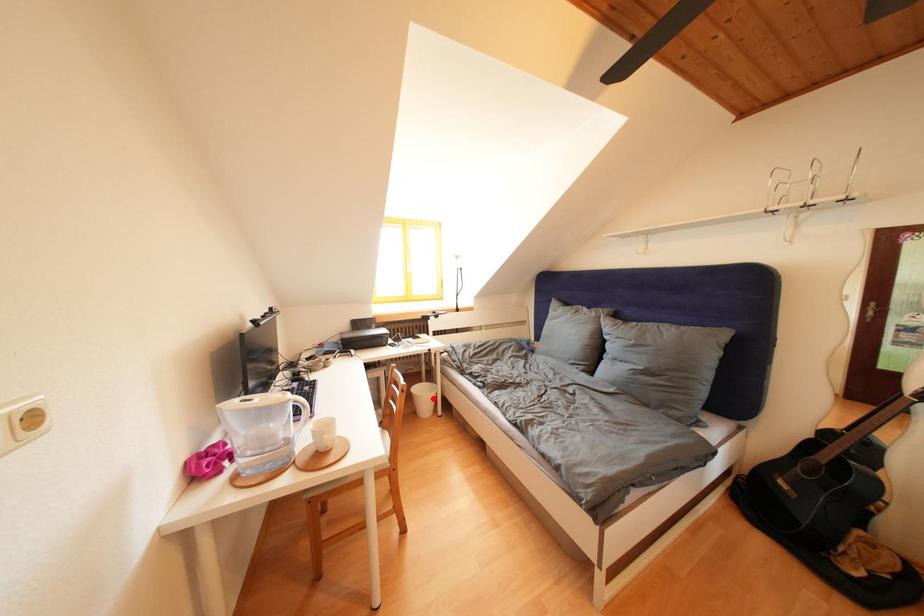
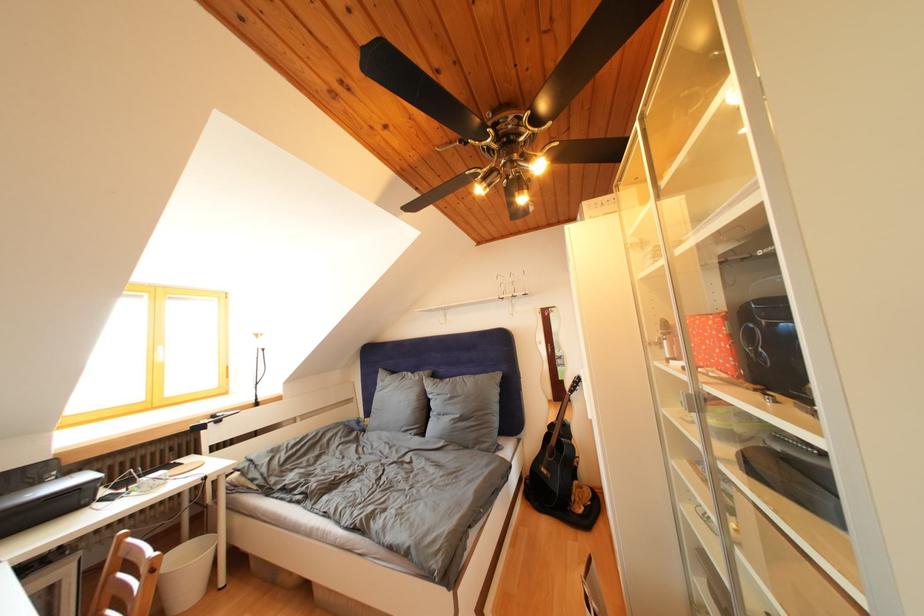
Question: I am providing you with two images of the same scene from different viewpoints. A red point is shown in image1. For the corresponding object point in image2, is it positioned nearer or farther from the camera?

Choices:
 (A) Nearer
 (B) Farther

Answer: (A)